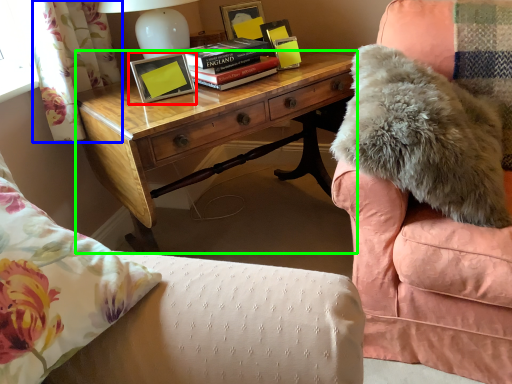
Question: Estimate the real-world distances between objects in this image. Which object is closer to picture frame (highlighted by a red box), curtain (highlighted by a blue box) or desk (highlighted by a green box)?

Choices:
 (A) curtain
 (B) desk

Answer: (B)